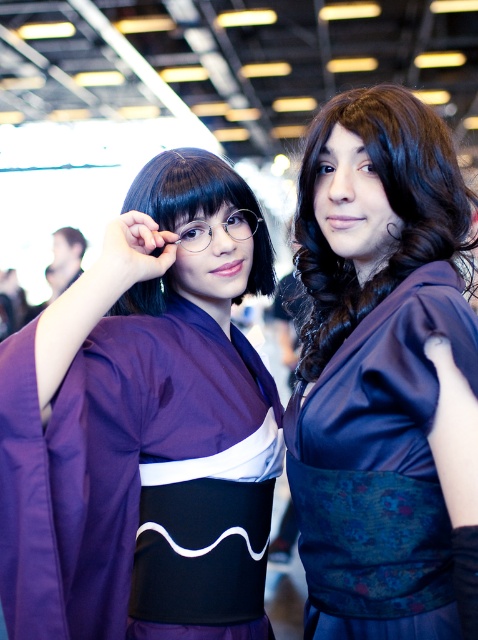
Who is taller, satin purple kimono at center or matte black glasses at center?

With more height is satin purple kimono at center.

Does point (412, 365) lie in front of point (201, 182)?

Yes, point (412, 365) is closer to viewer.

This screenshot has height=640, width=478. In order to click on satin purple kimono at center in this screenshot , I will do `click(382, 371)`.

Can you confirm if matte purple kimono at left is smaller than satin purple kimono at center?

Incorrect, matte purple kimono at left is not smaller in size than satin purple kimono at center.

Which of these two, matte purple kimono at left or satin purple kimono at center, stands taller?

Standing taller between the two is satin purple kimono at center.

Who is more forward, (158,428) or (346,534)?

Point (346,534)

Where is `matte purple kimono at left`? This screenshot has width=478, height=640. matte purple kimono at left is located at coordinates point(145,428).

Who is more forward, (64, 502) or (217, 157)?

Point (64, 502) is more forward.

Which is more to the left, matte purple kimono at left or matte black glasses at center?

Positioned to the left is matte purple kimono at left.

Describe the element at coordinates (145, 428) in the screenshot. I see `matte purple kimono at left` at that location.

The height and width of the screenshot is (640, 478). What are the coordinates of `matte purple kimono at left` in the screenshot? It's located at (145, 428).